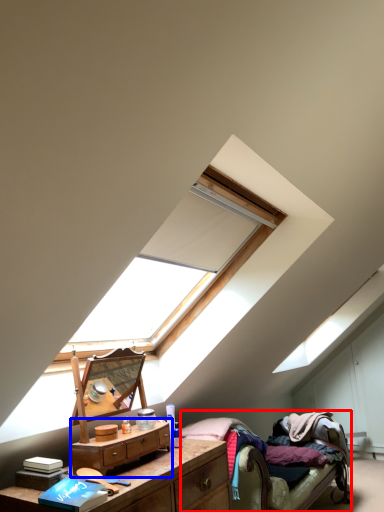
Question: Which point is closer to the camera, bed (highlighted by a red box) or nightstand (highlighted by a blue box)?

Choices:
 (A) bed
 (B) nightstand

Answer: (B)